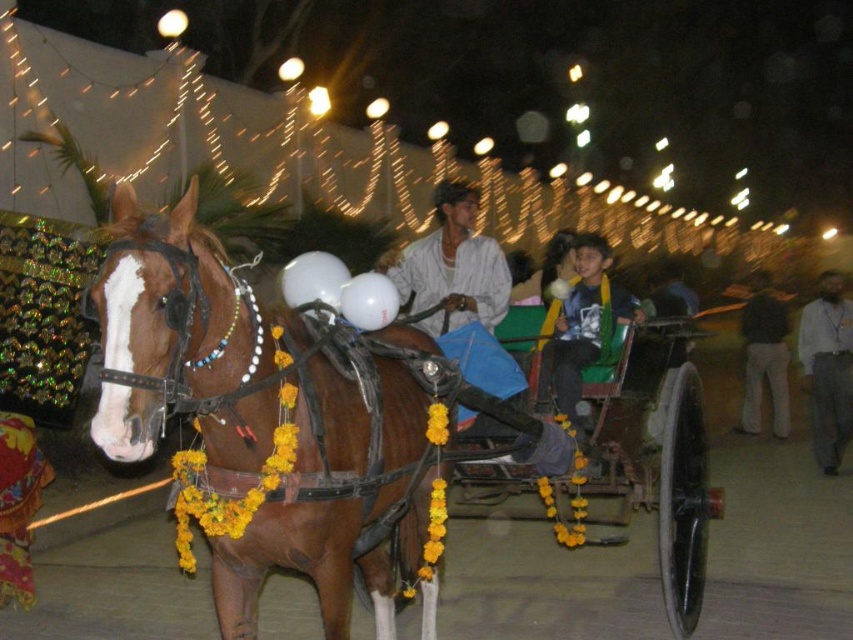
You are a photographer trying to capture the scene of the horse and cart. You want to make sure both the yellow fabric shirt at center and the dark gray sweater at right are visible in your photo. Which object should you focus on to ensure both are in frame?

You should focus on the yellow fabric shirt at center because it occupies less space than the dark gray sweater at right, so ensuring it is in frame will naturally include the larger dark gray sweater at right as well.

You are a photographer standing in front of the horse and cart. You want to take a photo of both the beige fabric shirt at right and the dark gray sweater at right in the same frame. The camera you have can capture a maximum width of 3 meters. Will both items fit in the frame?

The beige fabric shirt at right and dark gray sweater at right are 2.92 meters apart from each other, which is less than the camera frame width of 3 meters. Therefore, both items can fit in the frame.